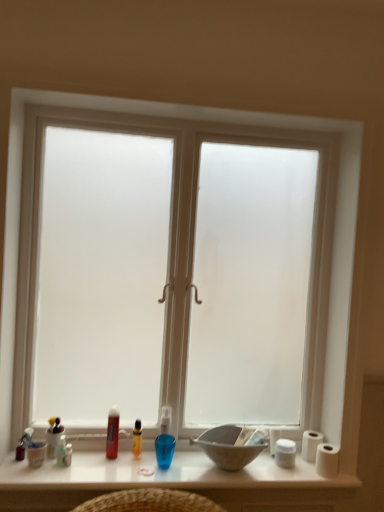
Where is `free space in front of translucent plastic container at lower left, which is counted as the fifth toiletry, starting from the right`? Image resolution: width=384 pixels, height=512 pixels. free space in front of translucent plastic container at lower left, which is counted as the fifth toiletry, starting from the right is located at coordinates (41, 472).